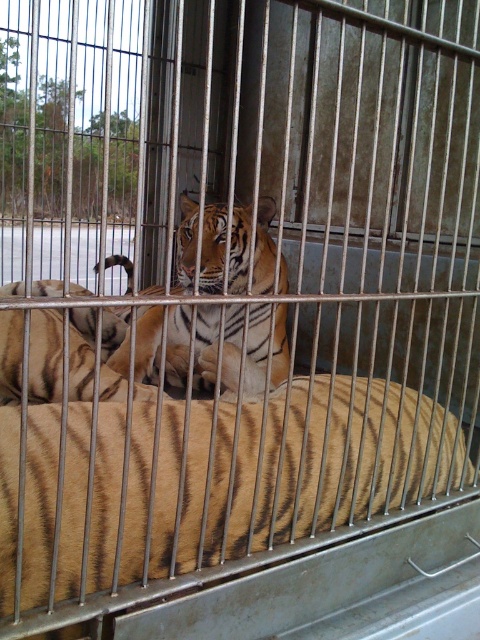
You are standing in front of the cage with two tigers. There are two points marked on the cage at coordinates point (74, 576) and point (195, 323). Which point is closer to you?

Point (74, 576) is in front of point (195, 323), so it is closer to you.